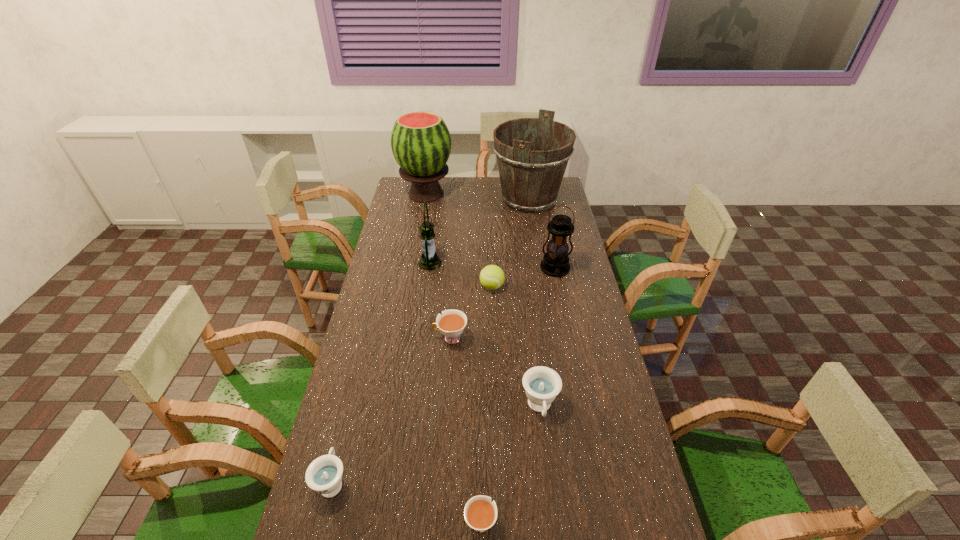
Identify the location of the leftmost teacup. The height and width of the screenshot is (540, 960). (324, 475).

Identify the location of free region located 0.330m on the front of the bucket. (540, 265).

At what (x,y) coordinates should I click in order to perform the action: click on free space located 0.390m on the right of the watermelon. Please return your answer as a coordinate pair (x, y). This screenshot has height=540, width=960. Looking at the image, I should click on (529, 194).

The width and height of the screenshot is (960, 540). Identify the location of vacant space situated 0.260m on the side where the left lantern emits light. (504, 263).

Find a few locations in the blank space located 0.280m above the right lantern, indicating its light source. Please provide its 2D coordinates. Your answer should be formatted as a tuple, i.e. [(x, y)], where the tuple contains the x and y coordinates of a point satisfying the conditions above.

[(567, 332)]

Locate an element on the screen. The width and height of the screenshot is (960, 540). vacant position located on the side of the seventh farthest object with the handle is located at coordinates (550, 498).

You are a GUI agent. You are given a task and a screenshot of the screen. Output one action in this format:
    pyautogui.click(x=<x>, y=<y>)
    Task: Click on the vacant region located on the left of the green tennis ball
    This screenshot has width=960, height=540.
    Given the screenshot: What is the action you would take?
    pyautogui.click(x=380, y=287)

Find the location of a particular element. vacant space located 0.230m on the side of the farthest teacup with the handle is located at coordinates (368, 338).

Locate an element on the screen. This screenshot has height=540, width=960. free point located on the side of the farthest teacup with the handle is located at coordinates (396, 338).

This screenshot has height=540, width=960. I want to click on vacant position located on the side of the nearer blue teacup with the handle, so click(x=358, y=381).